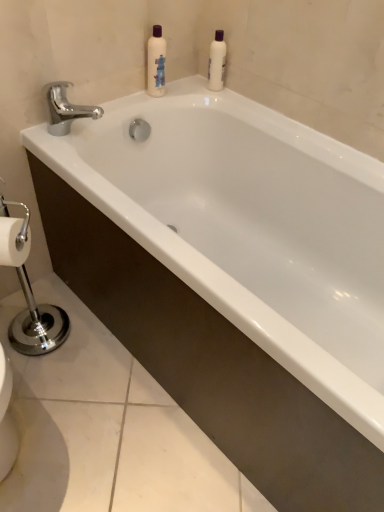
Question: Considering the relative sizes of chrome/metallic faucet at upper left and white glossy bottle at upper center, marked as the first cleaning product in a left-to-right arrangement, in the image provided, is chrome/metallic faucet at upper left thinner than white glossy bottle at upper center, marked as the first cleaning product in a left-to-right arrangement,?

Choices:
 (A) no
 (B) yes

Answer: (A)

Question: Is chrome/metallic faucet at upper left aimed at white glossy bottle at upper center, marked as the first cleaning product in a left-to-right arrangement?

Choices:
 (A) no
 (B) yes

Answer: (A)

Question: Is chrome/metallic faucet at upper left further to camera compared to white glossy bottle at upper center, marked as the first cleaning product in a left-to-right arrangement?

Choices:
 (A) yes
 (B) no

Answer: (B)

Question: Is chrome/metallic faucet at upper left directly adjacent to white glossy bottle at upper center, marked as the second cleaning product in a right-to-left arrangement?

Choices:
 (A) no
 (B) yes

Answer: (A)

Question: Is chrome/metallic faucet at upper left completely or partially outside of white glossy bottle at upper center, marked as the first cleaning product in a left-to-right arrangement?

Choices:
 (A) yes
 (B) no

Answer: (A)

Question: From the image's perspective, is white glossy bottle at upper center, marked as the second cleaning product in a right-to-left arrangement, positioned above or below chrome/metallic faucet at upper left?

Choices:
 (A) above
 (B) below

Answer: (A)

Question: Considering the positions of white glossy bottle at upper center, marked as the first cleaning product in a left-to-right arrangement, and chrome/metallic faucet at upper left in the image, is white glossy bottle at upper center, marked as the first cleaning product in a left-to-right arrangement, taller or shorter than chrome/metallic faucet at upper left?

Choices:
 (A) short
 (B) tall

Answer: (B)

Question: Is white glossy bottle at upper center, marked as the second cleaning product in a right-to-left arrangement, wider or thinner than chrome/metallic faucet at upper left?

Choices:
 (A) wide
 (B) thin

Answer: (B)

Question: Is white glossy bottle at upper center, marked as the second cleaning product in a right-to-left arrangement, inside or outside of chrome/metallic faucet at upper left?

Choices:
 (A) outside
 (B) inside

Answer: (A)

Question: Is point (158, 35) closer or farther from the camera than point (210, 57)?

Choices:
 (A) closer
 (B) farther

Answer: (A)

Question: In the image, is white glossy bottle at upper center, marked as the first cleaning product in a left-to-right arrangement, positioned in front of or behind white plastic bottle at upper center, the second cleaning product when ordered from left to right?

Choices:
 (A) front
 (B) behind

Answer: (A)

Question: From the image's perspective, is white glossy bottle at upper center, marked as the first cleaning product in a left-to-right arrangement, above or below white plastic bottle at upper center, the second cleaning product when ordered from left to right?

Choices:
 (A) below
 (B) above

Answer: (A)

Question: In terms of width, does white glossy bottle at upper center, marked as the second cleaning product in a right-to-left arrangement, look wider or thinner when compared to white plastic bottle at upper center, the second cleaning product when ordered from left to right?

Choices:
 (A) wide
 (B) thin

Answer: (A)

Question: Looking at the image, does chrome/metallic faucet at upper left seem bigger or smaller compared to white glossy bottle at upper center, marked as the first cleaning product in a left-to-right arrangement?

Choices:
 (A) big
 (B) small

Answer: (A)

Question: Is chrome/metallic faucet at upper left in front of or behind white glossy bottle at upper center, marked as the first cleaning product in a left-to-right arrangement, in the image?

Choices:
 (A) front
 (B) behind

Answer: (A)